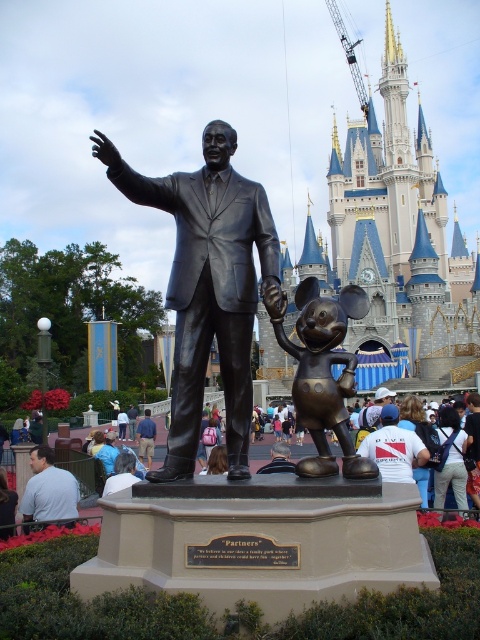
Question: Based on their relative distances, which object is nearer to the metallic gray crane at upper center?

Choices:
 (A) gray shirt at lower left
 (B) bronze mickey mouse at center

Answer: (B)

Question: Considering the relative positions of metallic gray crane at upper center and blue shirt at lower left in the image provided, where is metallic gray crane at upper center located with respect to blue shirt at lower left?

Choices:
 (A) below
 (B) above

Answer: (B)

Question: Is bronze statue at center smaller than bronze mickey mouse at center?

Choices:
 (A) no
 (B) yes

Answer: (A)

Question: Which object is closer to the camera taking this photo?

Choices:
 (A) blue shirt at lower left
 (B) bronze statue at center
 (C) gray shirt at lower left

Answer: (B)

Question: Which object is the closest to the gray shirt at lower left?

Choices:
 (A) metallic gray crane at upper center
 (B) bronze statue at center
 (C) blue stone castle at center

Answer: (B)

Question: Is the position of bronze statue at center more distant than that of bronze mickey mouse at center?

Choices:
 (A) no
 (B) yes

Answer: (B)